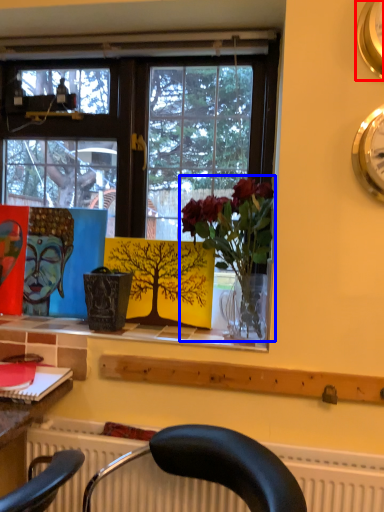
Question: Which point is closer to the camera, clock (highlighted by a red box) or houseplant (highlighted by a blue box)?

Choices:
 (A) clock
 (B) houseplant

Answer: (A)